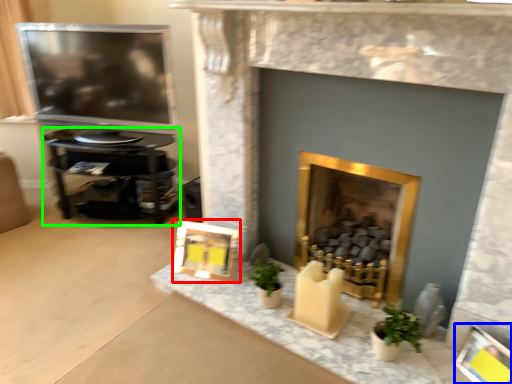
Question: Considering the real-world distances, which object is farthest from picture frame (highlighted by a red box)? picture frame (highlighted by a blue box) or furniture (highlighted by a green box)?

Choices:
 (A) picture frame
 (B) furniture

Answer: (A)